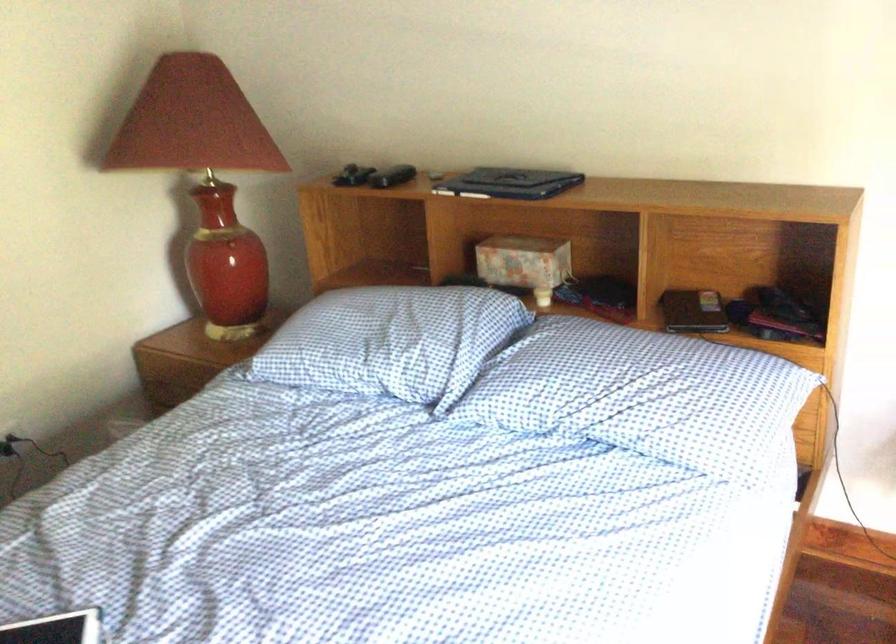
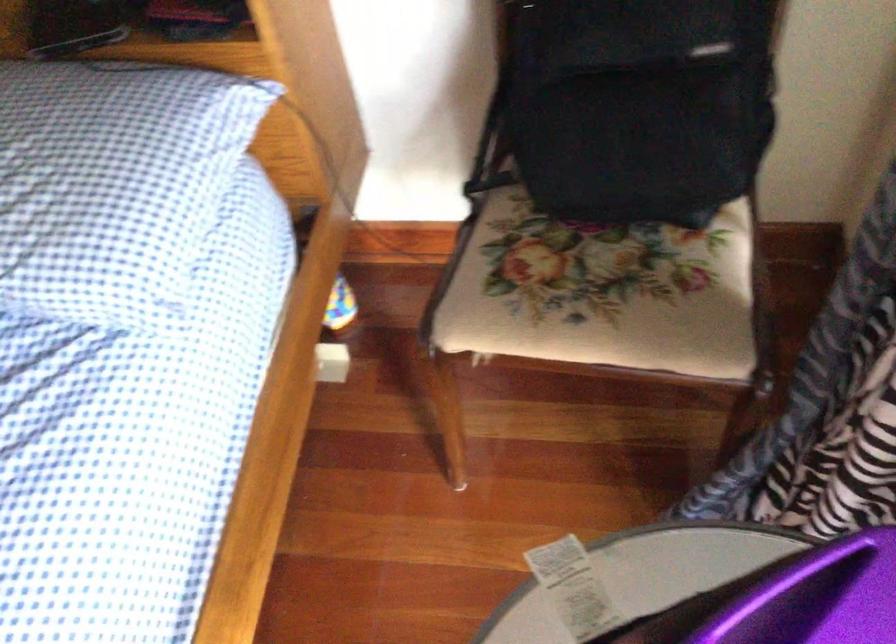
The first image is from the beginning of the video and the second image is from the end. How did the camera likely rotate when shooting the video?

The rotation direction of the camera is right-down.